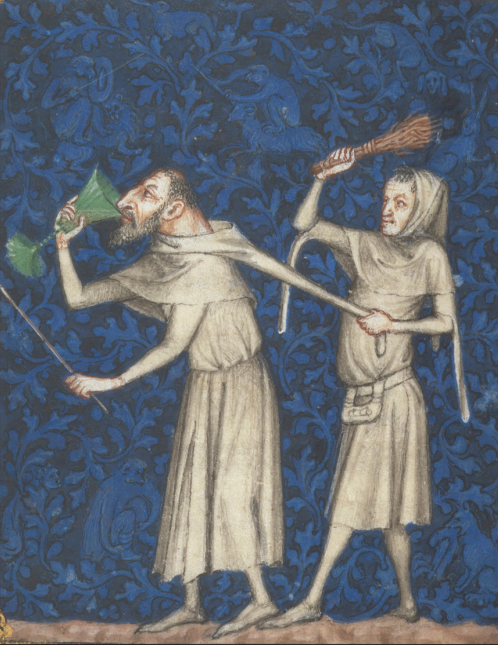
The image size is (498, 645). I want to click on whisk broom, so click(398, 131).